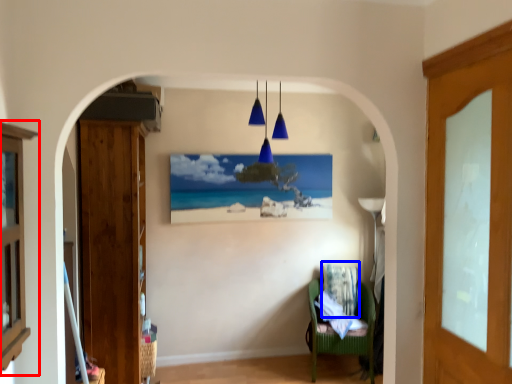
Question: Which point is further to the camera, cabinetry (highlighted by a red box) or pillow (highlighted by a blue box)?

Choices:
 (A) cabinetry
 (B) pillow

Answer: (B)